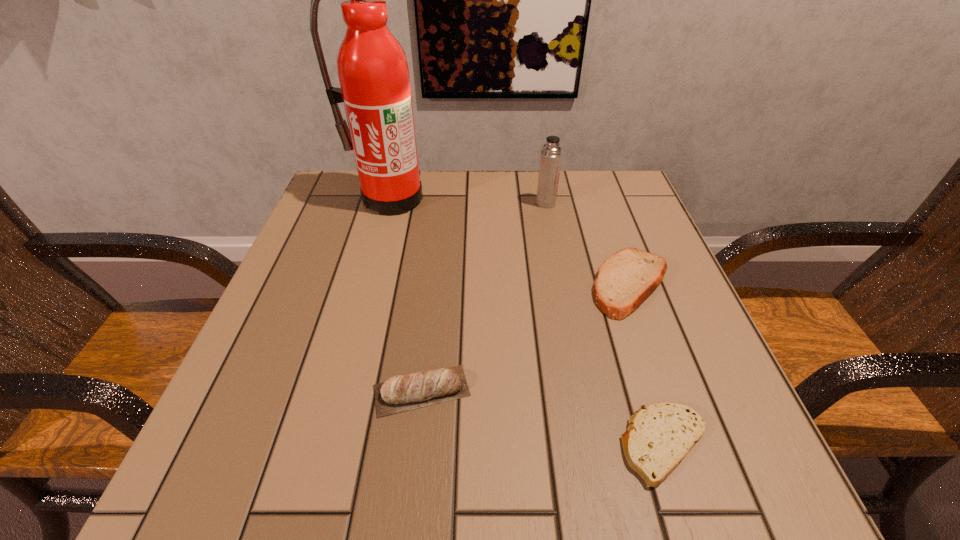
In order to click on free spot between the third object from right to left and the shortest pita bread in this screenshot , I will do `click(605, 324)`.

Image resolution: width=960 pixels, height=540 pixels. In order to click on vacant area that lies between the farthest pita bread and the tallest object in this screenshot , I will do `click(510, 242)`.

Locate which object is the second closest to the shortest object. Please provide its 2D coordinates. Your answer should be formatted as a tuple, i.e. [(x, y)], where the tuple contains the x and y coordinates of a point satisfying the conditions above.

[(400, 393)]

The height and width of the screenshot is (540, 960). What are the coordinates of `object that is the fourth closest to the tallest object` in the screenshot? It's located at (660, 435).

Point out which pita bread is positioned as the second nearest to the fourth shortest object. Please provide its 2D coordinates. Your answer should be formatted as a tuple, i.e. [(x, y)], where the tuple contains the x and y coordinates of a point satisfying the conditions above.

[(400, 393)]

This screenshot has height=540, width=960. Find the location of `pita bread that is the second closest to the leftmost pita bread`. pita bread that is the second closest to the leftmost pita bread is located at coordinates (625, 279).

Locate an element on the screen. The image size is (960, 540). free space in the image that satisfies the following two spatial constraints: 1. on the label side of the fire extinguisher; 2. on the left side of the third nearest object is located at coordinates (367, 285).

What are the coordinates of `free space that satisfies the following two spatial constraints: 1. on the label side of the tallest object; 2. on the right side of the third nearest object` in the screenshot? It's located at (367, 285).

Locate an element on the screen. The width and height of the screenshot is (960, 540). free spot that satisfies the following two spatial constraints: 1. on the front side of the farthest pita bread; 2. on the left side of the third object from left to right is located at coordinates (562, 285).

Locate an element on the screen. The height and width of the screenshot is (540, 960). free space that satisfies the following two spatial constraints: 1. on the label side of the fourth shortest object; 2. on the left side of the tallest object is located at coordinates (389, 203).